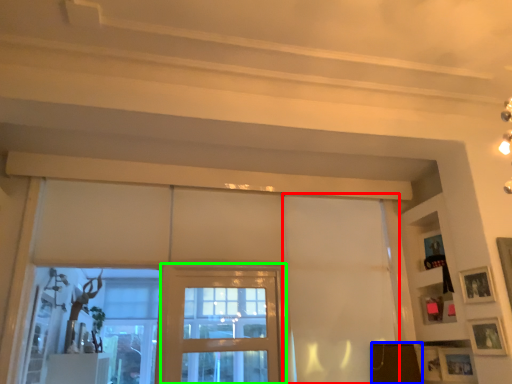
Question: Considering the real-world distances, which object is closest to curtain (highlighted by a red box)? furniture (highlighted by a blue box) or screen door (highlighted by a green box).

Choices:
 (A) furniture
 (B) screen door

Answer: (A)